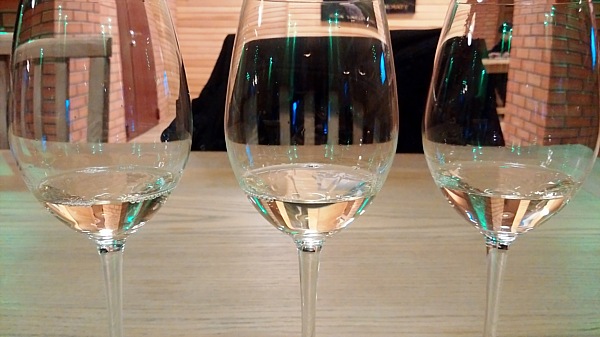
The width and height of the screenshot is (600, 337). I want to click on picture, so click(x=399, y=10).